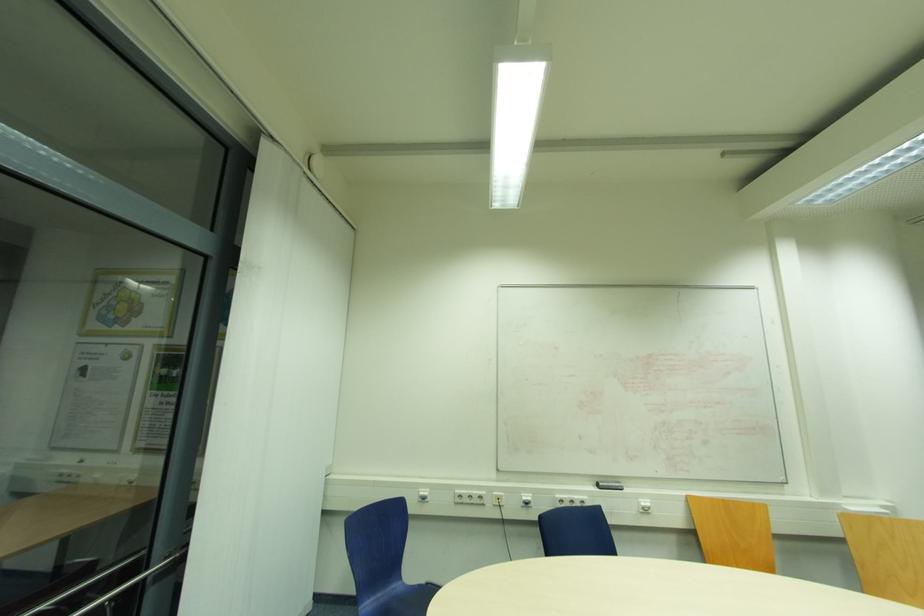
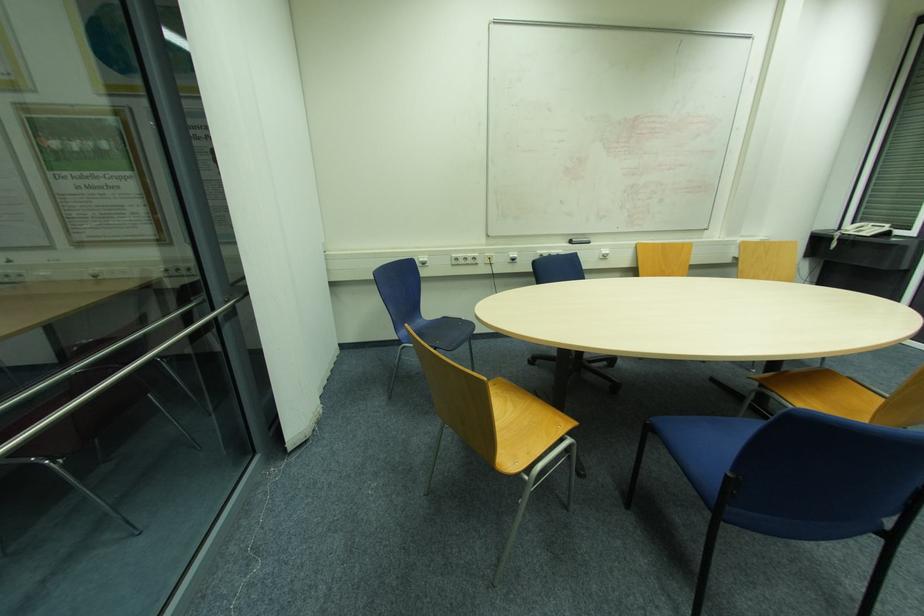
The point at (471,496) is marked in the first image. Where is the corresponding point in the second image?

(467, 259)